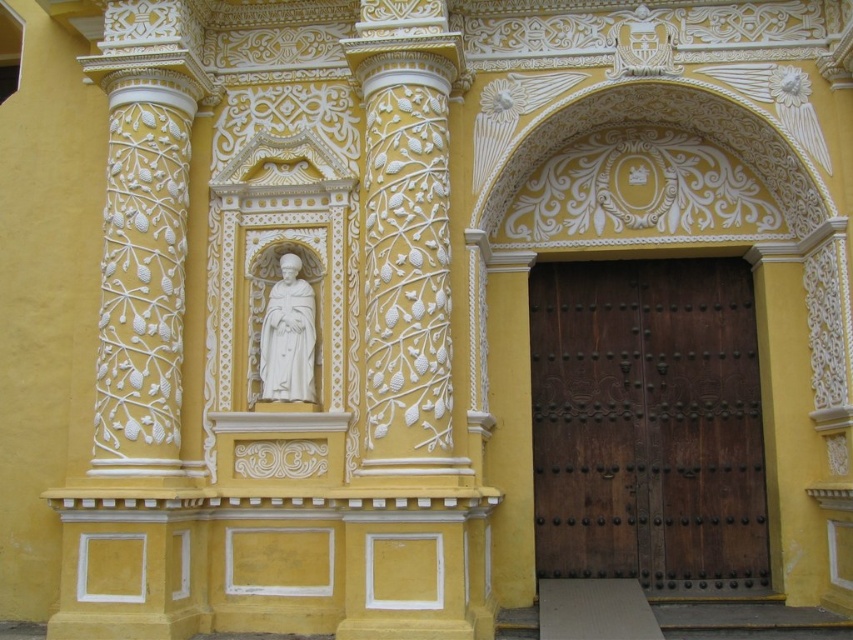
Can you confirm if dark brown wood door at center is taller than white marble statue at center?

Yes.

Does dark brown wood door at center have a lesser width compared to white marble statue at center?

No, dark brown wood door at center is not thinner than white marble statue at center.

Find the location of a particular element. The width and height of the screenshot is (853, 640). dark brown wood door at center is located at coordinates (647, 422).